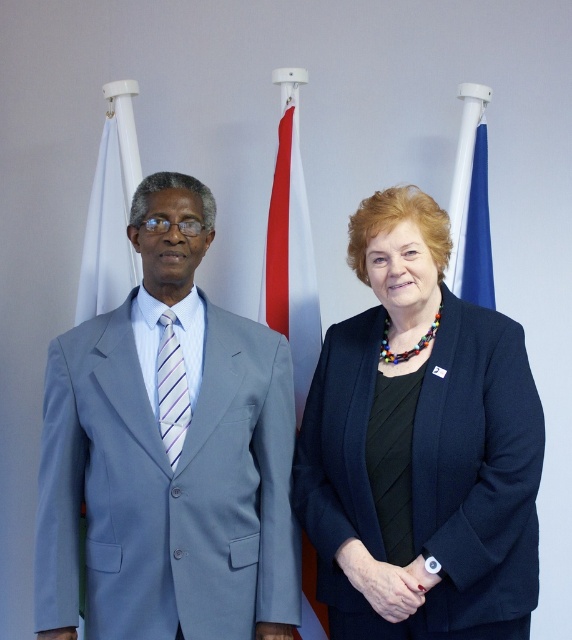
Question: Can you confirm if black fabric jacket at center is wider than blue fabric flag at right?

Choices:
 (A) yes
 (B) no

Answer: (A)

Question: Does light blue suit at left appear over black fabric jacket at center?

Choices:
 (A) no
 (B) yes

Answer: (B)

Question: Among these objects, which one is nearest to the camera?

Choices:
 (A) striped fabric tie at center
 (B) light blue suit at left

Answer: (B)

Question: Which of these objects is positioned farthest from the light blue suit at left?

Choices:
 (A) black fabric jacket at center
 (B) striped fabric tie at center
 (C) white fabric flag at left
 (D) blue fabric flag at right

Answer: (D)

Question: Which object is the farthest from the white fabric flag at center?

Choices:
 (A) striped fabric tie at center
 (B) black fabric jacket at center

Answer: (A)

Question: Does white fabric flag at left appear under striped fabric tie at center?

Choices:
 (A) yes
 (B) no

Answer: (B)